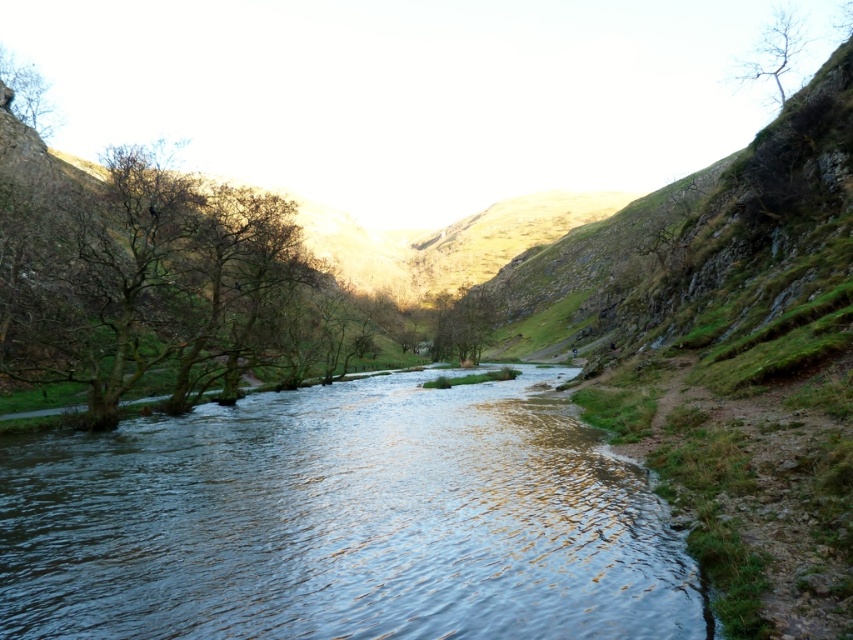
Is bare branches at upper right shorter than brown leafless tree at upper left?

In fact, bare branches at upper right may be taller than brown leafless tree at upper left.

Is bare branches at upper right positioned at the back of brown leafless tree at upper left?

No, it is not.

Find the location of a particular element. bare branches at upper right is located at coordinates (775, 51).

In the scene shown: Who is positioned more to the right, bare branches at left or green matte tree at center?

From the viewer's perspective, green matte tree at center appears more on the right side.

Is bare branches at left thinner than green matte tree at center?

No.

Is point (264, 326) more distant than point (444, 323)?

No.

You are a GUI agent. You are given a task and a screenshot of the screen. Output one action in this format:
    pyautogui.click(x=<x>, y=<y>)
    Task: Click on the bare branches at left
    The width and height of the screenshot is (853, 640).
    Given the screenshot: What is the action you would take?
    [x=144, y=280]

Does bare branches at left appear on the right side of brown leafless tree at upper left?

Yes, bare branches at left is to the right of brown leafless tree at upper left.

Which is behind, point (245, 189) or point (20, 67)?

Positioned behind is point (20, 67).

Locate an element on the screen. bare branches at left is located at coordinates (144, 280).